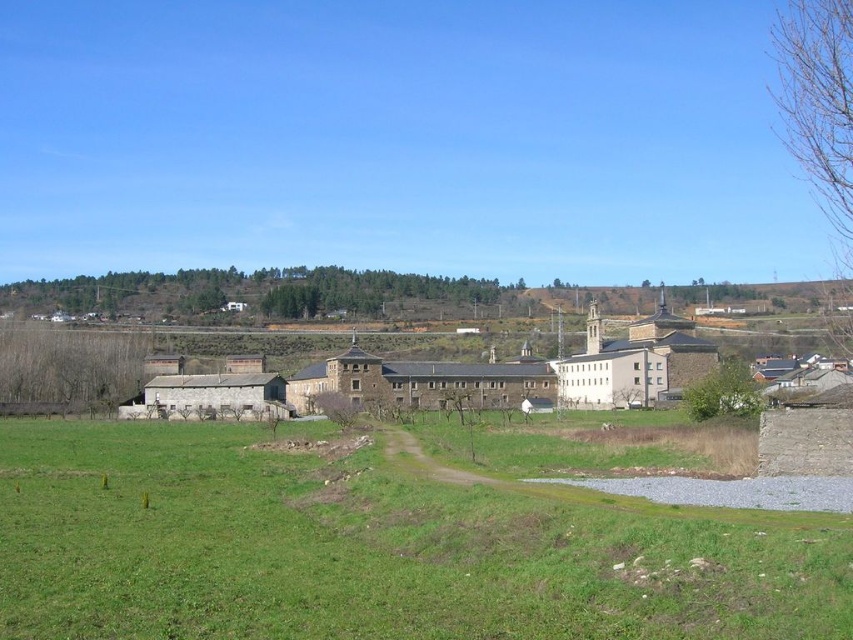
Is point (601, 612) closer to camera compared to point (213, 412)?

Yes, point (601, 612) is closer to viewer.

Can you confirm if green grass at lower left is positioned above stone building at center?

No.

Locate an element on the screen. This screenshot has width=853, height=640. green grass at lower left is located at coordinates (374, 548).

Locate an element on the screen. The image size is (853, 640). green grass at lower left is located at coordinates (374, 548).